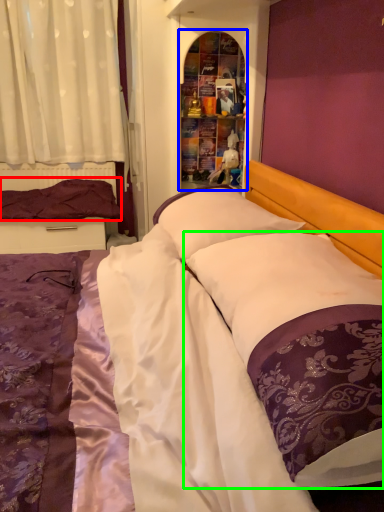
Question: Estimate the real-world distances between objects in this image. Which object is closer to pillow (highlighted by a red box), shelf (highlighted by a blue box) or pillow (highlighted by a green box)?

Choices:
 (A) shelf
 (B) pillow

Answer: (A)